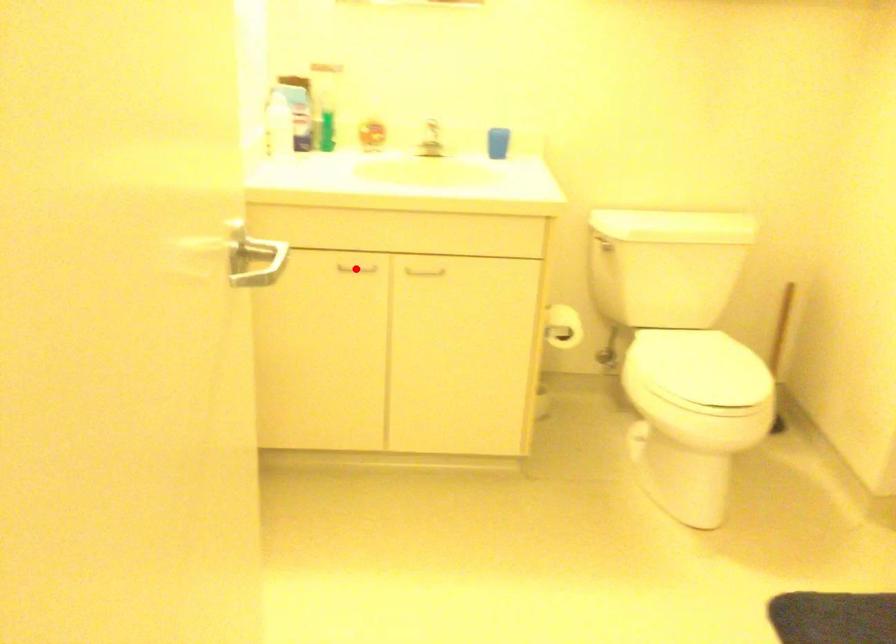
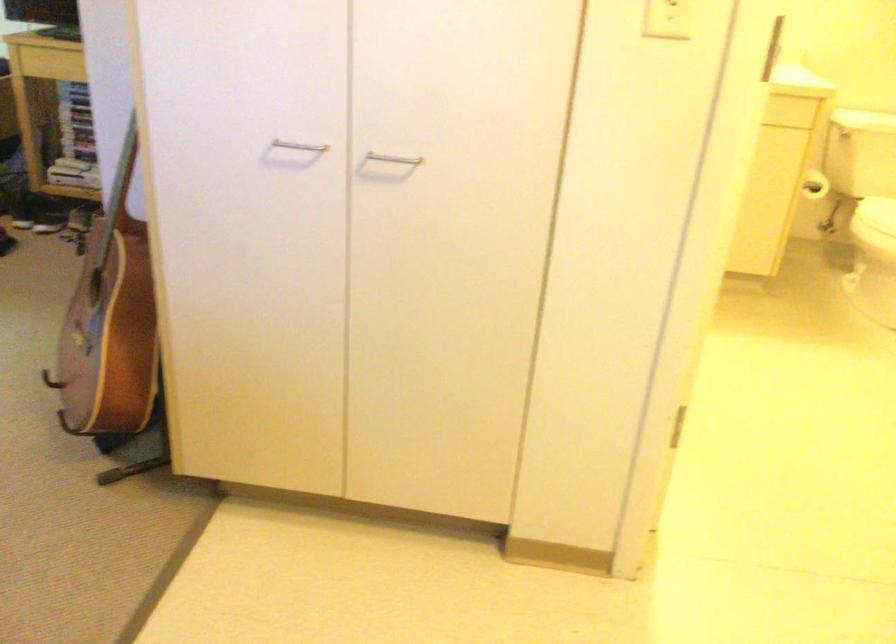
Question: I am providing you with two images of the same scene from different viewpoints. A red point is marked on the first image. Can you still see the location of the red point in image 2?

Choices:
 (A) Yes
 (B) No

Answer: (B)